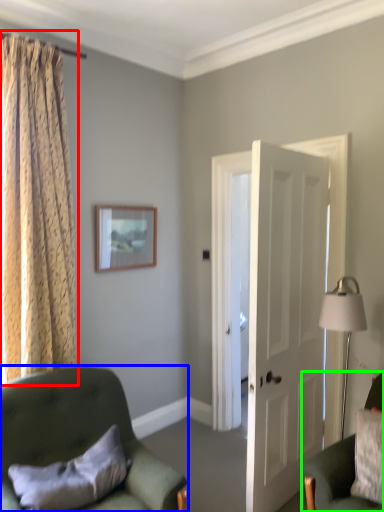
Question: Considering the real-world distances, which object is farthest from curtain (highlighted by a red box)? chair (highlighted by a blue box) or chair (highlighted by a green box)?

Choices:
 (A) chair
 (B) chair

Answer: (B)